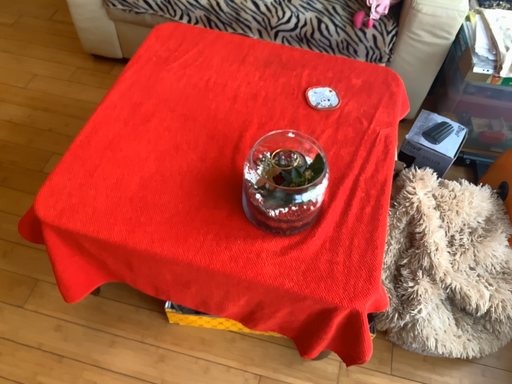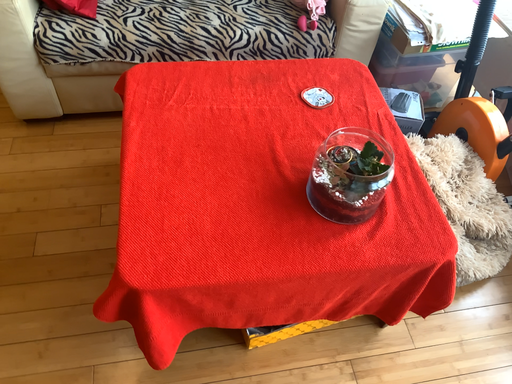
Question: Which way did the camera rotate in the video?

Choices:
 (A) rotated right
 (B) rotated left

Answer: (A)